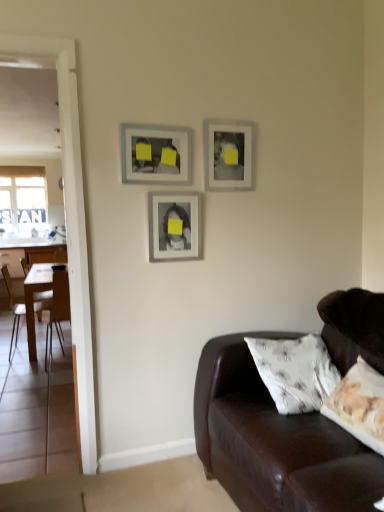
Describe the element at coordinates (69, 223) in the screenshot. I see `transparent glass door at left` at that location.

What is the approximate width of matte silver picture frame at center, which is counted as the 2th picture frame, starting from the left?

1.86 inches.

The height and width of the screenshot is (512, 384). Describe the element at coordinates (22, 198) in the screenshot. I see `transparent glass window at left` at that location.

The height and width of the screenshot is (512, 384). Describe the element at coordinates (37, 283) in the screenshot. I see `light brown wooden chair at left, the 1th chair in the left-to-right sequence` at that location.

The image size is (384, 512). Describe the element at coordinates (33, 298) in the screenshot. I see `white glossy table at left` at that location.

The height and width of the screenshot is (512, 384). Identify the location of transparent glass door at left. (69, 223).

Is white glossy table at left spatially inside light brown wooden chair at left, the 1th chair in the left-to-right sequence, or outside of it?

white glossy table at left is not inside light brown wooden chair at left, the 1th chair in the left-to-right sequence, it's outside.

Is white glossy table at left in contact with light brown wooden chair at left, the second chair viewed from the right?

Yes, the surface of white glossy table at left is in contact with light brown wooden chair at left, the second chair viewed from the right.

Does white glossy table at left come behind light brown wooden chair at left, the 1th chair in the left-to-right sequence?

No.

Is point (31, 276) positioned after point (5, 270)?

That is False.

Considering the relative positions of white glossy table at left and matte gray picture frame at upper center, which ranks as the 3th picture frame in left-to-right order, in the image provided, is white glossy table at left to the right of matte gray picture frame at upper center, which ranks as the 3th picture frame in left-to-right order, from the viewer's perspective?

In fact, white glossy table at left is to the left of matte gray picture frame at upper center, which ranks as the 3th picture frame in left-to-right order.

Can you confirm if white glossy table at left is smaller than matte gray picture frame at upper center, which appears as the 1th picture frame when viewed from the right?

No, white glossy table at left is not smaller than matte gray picture frame at upper center, which appears as the 1th picture frame when viewed from the right.

Is white glossy table at left located outside matte gray picture frame at upper center, which ranks as the 3th picture frame in left-to-right order?

Absolutely, white glossy table at left is external to matte gray picture frame at upper center, which ranks as the 3th picture frame in left-to-right order.

From the image's perspective, who appears lower, matte black picture frame at upper center, positioned as the first picture frame in left-to-right order, or matte gray picture frame at upper center, which ranks as the 3th picture frame in left-to-right order?

From the image's view, matte black picture frame at upper center, positioned as the first picture frame in left-to-right order, is below.

Image resolution: width=384 pixels, height=512 pixels. What are the coordinates of `picture frame that is the 2nd object located behind the matte black picture frame at upper center, which is counted as the 3th picture frame, starting from the right` in the screenshot? It's located at (227, 154).

How far apart are matte black picture frame at upper center, which is counted as the 3th picture frame, starting from the right, and matte gray picture frame at upper center, which appears as the 1th picture frame when viewed from the right?

9.43 inches.

Considering the relative sizes of matte black picture frame at upper center, positioned as the first picture frame in left-to-right order, and matte gray picture frame at upper center, which appears as the 1th picture frame when viewed from the right, in the image provided, is matte black picture frame at upper center, positioned as the first picture frame in left-to-right order, thinner than matte gray picture frame at upper center, which appears as the 1th picture frame when viewed from the right,?

Yes.

From the image's perspective, is white glossy table at left on matte black picture frame at upper center, which is counted as the 3th picture frame, starting from the right?

No, from the image's perspective, white glossy table at left is not on top of matte black picture frame at upper center, which is counted as the 3th picture frame, starting from the right.

How different are the orientations of white glossy table at left and matte black picture frame at upper center, positioned as the first picture frame in left-to-right order, in degrees?

90.7 degrees separate the facing orientations of white glossy table at left and matte black picture frame at upper center, positioned as the first picture frame in left-to-right order.

Is white glossy table at left bigger or smaller than matte black picture frame at upper center, positioned as the first picture frame in left-to-right order?

white glossy table at left is bigger than matte black picture frame at upper center, positioned as the first picture frame in left-to-right order.

Find the location of `table to the right of transparent glass window at left`. table to the right of transparent glass window at left is located at coordinates (33, 298).

Is transparent glass window at left with white glossy table at left?

transparent glass window at left is not next to white glossy table at left, and they're not touching.

Is point (23, 181) positioned behind point (28, 298)?

Yes, it is.

From the picture: Choose the correct answer: Is transparent glass window at left inside white glossy table at left or outside it?

transparent glass window at left cannot be found inside white glossy table at left.

Considering the relative sizes of transparent glass window at left and matte gray picture frame at upper center, which appears as the 1th picture frame when viewed from the right, in the image provided, is transparent glass window at left smaller than matte gray picture frame at upper center, which appears as the 1th picture frame when viewed from the right,?

Actually, transparent glass window at left might be larger than matte gray picture frame at upper center, which appears as the 1th picture frame when viewed from the right.

Is transparent glass window at left positioned with its back to matte gray picture frame at upper center, which ranks as the 3th picture frame in left-to-right order?

No, transparent glass window at left is not facing the opposite direction of matte gray picture frame at upper center, which ranks as the 3th picture frame in left-to-right order.

Considering the sizes of objects transparent glass window at left and matte gray picture frame at upper center, which appears as the 1th picture frame when viewed from the right, in the image provided, who is shorter, transparent glass window at left or matte gray picture frame at upper center, which appears as the 1th picture frame when viewed from the right,?

matte gray picture frame at upper center, which appears as the 1th picture frame when viewed from the right.

Can you tell me how much transparent glass window at left and matte gray picture frame at upper center, which appears as the 1th picture frame when viewed from the right, differ in facing direction?

The facing directions of transparent glass window at left and matte gray picture frame at upper center, which appears as the 1th picture frame when viewed from the right, are 0.538 degrees apart.

In the image, is matte silver picture frame at center, the second picture frame positioned from the right, positioned in front of or behind white glossy table at left?

matte silver picture frame at center, the second picture frame positioned from the right, is positioned closer to the viewer than white glossy table at left.

Is matte silver picture frame at center, which is counted as the 2th picture frame, starting from the left, looking in the opposite direction of white glossy table at left?

Yes, white glossy table at left is at the back of matte silver picture frame at center, which is counted as the 2th picture frame, starting from the left.

From a real-world perspective, between matte silver picture frame at center, which is counted as the 2th picture frame, starting from the left, and white glossy table at left, who is vertically higher?

matte silver picture frame at center, which is counted as the 2th picture frame, starting from the left, from a real-world perspective.

Locate an element on the screen. The image size is (384, 512). table that is on the left side of matte silver picture frame at center, which is counted as the 2th picture frame, starting from the left is located at coordinates (33, 298).

Locate an element on the screen. The width and height of the screenshot is (384, 512). table that appears below the light brown wooden chair at left, the 1th chair in the left-to-right sequence (from a real-world perspective) is located at coordinates (33, 298).

Identify the location of the 3rd picture frame above the white glossy table at left (from a real-world perspective). pos(227,154).

When comparing their distances from matte silver picture frame at center, the second picture frame positioned from the right, does wooden chair at left, which is the second chair in left-to-right order, or matte gray picture frame at upper center, which appears as the 1th picture frame when viewed from the right, seem further?

The object further to matte silver picture frame at center, the second picture frame positioned from the right, is wooden chair at left, which is the second chair in left-to-right order.

Considering their positions, is light brown wooden chair at left, the 1th chair in the left-to-right sequence, positioned further to transparent glass door at left than matte black picture frame at upper center, positioned as the first picture frame in left-to-right order?

light brown wooden chair at left, the 1th chair in the left-to-right sequence, is positioned further to the anchor transparent glass door at left.

Looking at this image, from the image, which object appears to be nearer to light brown wooden chair at left, the second chair viewed from the right, wooden chair at left, which is the second chair in left-to-right order, or matte black picture frame at upper center, positioned as the first picture frame in left-to-right order?

wooden chair at left, which is the second chair in left-to-right order, is positioned closer to the anchor light brown wooden chair at left, the second chair viewed from the right.

From the image, which object appears to be nearer to transparent glass door at left, white glossy table at left or matte black picture frame at upper center, which is counted as the 3th picture frame, starting from the right?

Among the two, matte black picture frame at upper center, which is counted as the 3th picture frame, starting from the right, is located nearer to transparent glass door at left.

Looking at the image, which one is located closer to matte silver picture frame at center, which is counted as the 2th picture frame, starting from the left, transparent glass door at left or transparent glass window at left?

transparent glass door at left is positioned closer to the anchor matte silver picture frame at center, which is counted as the 2th picture frame, starting from the left.

From the image, which object appears to be farther from matte gray picture frame at upper center, which appears as the 1th picture frame when viewed from the right, light brown wooden chair at left, the 1th chair in the left-to-right sequence, or transparent glass door at left?

Among the two, light brown wooden chair at left, the 1th chair in the left-to-right sequence, is located further to matte gray picture frame at upper center, which appears as the 1th picture frame when viewed from the right.

Which object lies nearer to the anchor point matte gray picture frame at upper center, which ranks as the 3th picture frame in left-to-right order, wooden chair at left, placed as the first chair when sorted from right to left, or light brown wooden chair at left, the second chair viewed from the right?

wooden chair at left, placed as the first chair when sorted from right to left, lies closer to matte gray picture frame at upper center, which ranks as the 3th picture frame in left-to-right order, than the other object.

Looking at the image, which one is located further to matte black picture frame at upper center, positioned as the first picture frame in left-to-right order, matte gray picture frame at upper center, which ranks as the 3th picture frame in left-to-right order, or matte silver picture frame at center, which is counted as the 2th picture frame, starting from the left?

matte gray picture frame at upper center, which ranks as the 3th picture frame in left-to-right order, is further to matte black picture frame at upper center, positioned as the first picture frame in left-to-right order.

Locate an element on the screen. The width and height of the screenshot is (384, 512). chair between transparent glass door at left and white glossy table at left from front to back is located at coordinates (58, 310).

Identify the location of chair between matte silver picture frame at center, the second picture frame positioned from the right, and light brown wooden chair at left, the 1th chair in the left-to-right sequence, in the front-back direction. (58, 310).

The height and width of the screenshot is (512, 384). Find the location of `chair between matte silver picture frame at center, which is counted as the 2th picture frame, starting from the left, and white glossy table at left in the front-back direction`. chair between matte silver picture frame at center, which is counted as the 2th picture frame, starting from the left, and white glossy table at left in the front-back direction is located at coordinates (58, 310).

Find the location of a particular element. chair positioned between transparent glass door at left and light brown wooden chair at left, the 1th chair in the left-to-right sequence, from near to far is located at coordinates (58, 310).